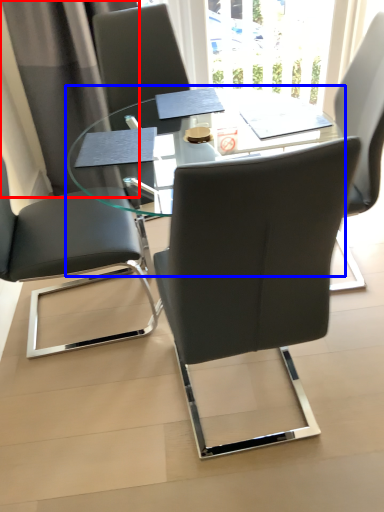
Question: Which point is closer to the camera, curtain (highlighted by a red box) or table (highlighted by a blue box)?

Choices:
 (A) curtain
 (B) table

Answer: (B)